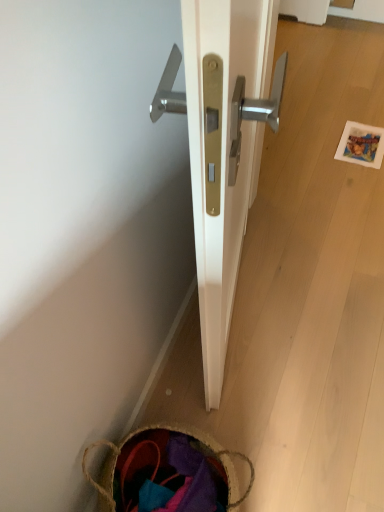
Question: Is brown woven basket at lower left bigger or smaller than polished brass door handle at center?

Choices:
 (A) big
 (B) small

Answer: (B)

Question: Is brown woven basket at lower left taller or shorter than polished brass door handle at center?

Choices:
 (A) tall
 (B) short

Answer: (B)

Question: Considering the positions of brown woven basket at lower left and polished brass door handle at center in the image, is brown woven basket at lower left wider or thinner than polished brass door handle at center?

Choices:
 (A) thin
 (B) wide

Answer: (B)

Question: Considering their positions, is polished brass door handle at center located in front of or behind brown woven basket at lower left?

Choices:
 (A) front
 (B) behind

Answer: (A)

Question: Would you say polished brass door handle at center is to the left or to the right of brown woven basket at lower left in the picture?

Choices:
 (A) right
 (B) left

Answer: (A)

Question: Is polished brass door handle at center inside the boundaries of brown woven basket at lower left, or outside?

Choices:
 (A) outside
 (B) inside

Answer: (A)

Question: From their relative heights in the image, would you say polished brass door handle at center is taller or shorter than brown woven basket at lower left?

Choices:
 (A) short
 (B) tall

Answer: (B)